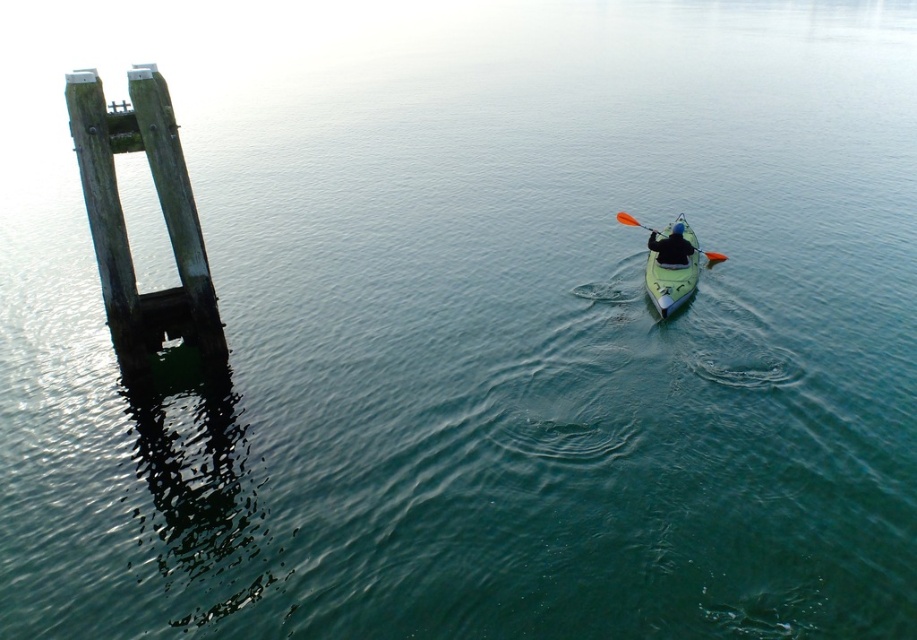
Question: Is matte green kayak at right wider than orange plastic paddle at center?

Choices:
 (A) no
 (B) yes

Answer: (A)

Question: Which point is farther to the camera?

Choices:
 (A) orange plastic paddle at center
 (B) weathered wood dock at left

Answer: (A)

Question: From the image, what is the correct spatial relationship of weathered wood dock at left in relation to matte green kayak at right?

Choices:
 (A) left
 (B) right

Answer: (A)

Question: Does matte green kayak at right appear under orange plastic paddle at center?

Choices:
 (A) no
 (B) yes

Answer: (B)

Question: Among these objects, which one is farthest from the camera?

Choices:
 (A) yellow-green plastic kayak at right
 (B) orange plastic paddle at center

Answer: (B)

Question: Which of these objects is positioned farthest from the weathered wood dock at left?

Choices:
 (A) matte green kayak at right
 (B) orange plastic paddle at center

Answer: (B)